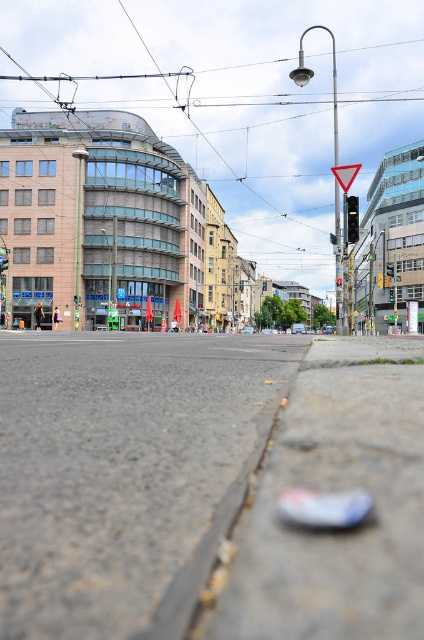
Does gray asphalt pavement at lower center have a smaller size compared to black plastic traffic light at upper center?

No, gray asphalt pavement at lower center is not smaller than black plastic traffic light at upper center.

Based on the photo, does gray asphalt pavement at lower center have a lesser width compared to black plastic traffic light at upper center?

In fact, gray asphalt pavement at lower center might be wider than black plastic traffic light at upper center.

This screenshot has height=640, width=424. Describe the element at coordinates (119, 465) in the screenshot. I see `gray asphalt pavement at lower center` at that location.

Locate an element on the screen. This screenshot has height=640, width=424. gray asphalt pavement at lower center is located at coordinates (119, 465).

Measure the distance between gray asphalt pavement at lower center and black glass traffic light at center.

10.92 meters

Which of these two, gray asphalt pavement at lower center or black glass traffic light at center, stands shorter?

gray asphalt pavement at lower center

The width and height of the screenshot is (424, 640). Describe the element at coordinates (119, 465) in the screenshot. I see `gray asphalt pavement at lower center` at that location.

Locate an element on the screen. Image resolution: width=424 pixels, height=640 pixels. gray asphalt pavement at lower center is located at coordinates (119, 465).

Does black glass traffic light at center appear on the left side of black plastic traffic light at upper center?

In fact, black glass traffic light at center is to the right of black plastic traffic light at upper center.

Is point (346, 209) farther from camera compared to point (339, 282)?

No, (346, 209) is closer to viewer.

Which is in front, point (349, 200) or point (335, 284)?

Point (349, 200) is in front.

You are a GUI agent. You are given a task and a screenshot of the screen. Output one action in this format:
    pyautogui.click(x=<x>, y=<y>)
    Task: Click on the black glass traffic light at center
    The height and width of the screenshot is (640, 424).
    Given the screenshot: What is the action you would take?
    [x=351, y=218]